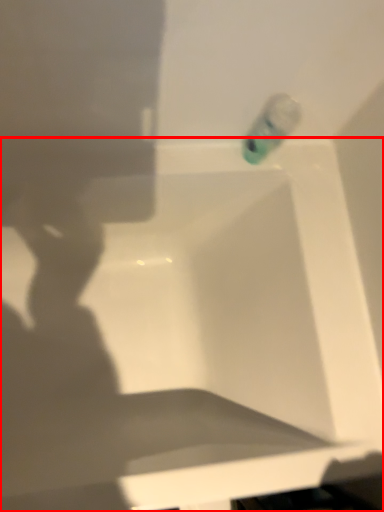
Question: From the image's perspective, considering the relative positions of bathtub (annotated by the red box) and liquid in the image provided, where is bathtub (annotated by the red box) located with respect to the staircase?

Choices:
 (A) below
 (B) above

Answer: (A)